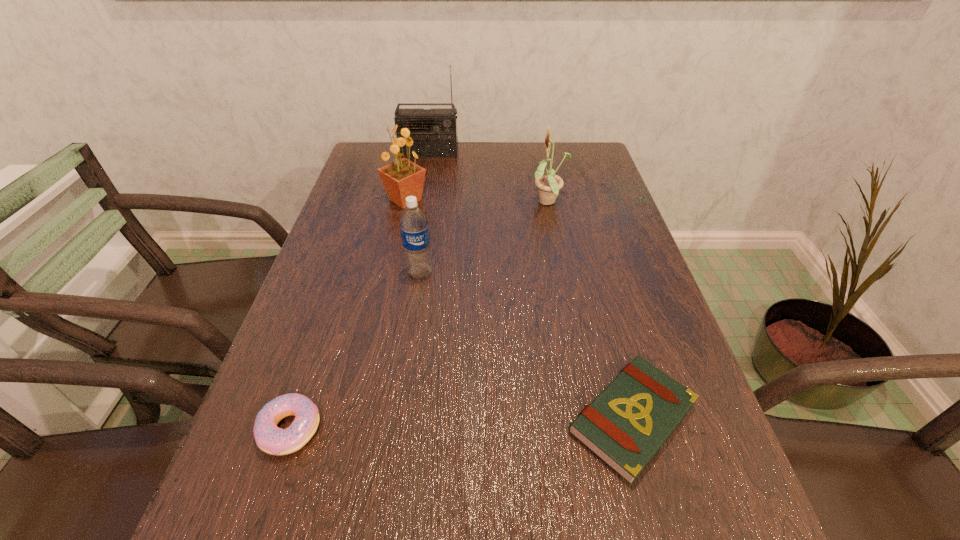
Image resolution: width=960 pixels, height=540 pixels. I want to click on the farthest object, so click(435, 133).

Locate an element on the screen. This screenshot has width=960, height=540. the tallest object is located at coordinates (435, 133).

The image size is (960, 540). Find the location of `the left sunflower`. the left sunflower is located at coordinates (402, 178).

In order to click on the right sunflower in this screenshot , I will do `click(549, 184)`.

I want to click on water bottle, so click(414, 228).

You are a GUI agent. You are given a task and a screenshot of the screen. Output one action in this format:
    pyautogui.click(x=<x>, y=<y>)
    Task: Click on the doughnut
    The height and width of the screenshot is (540, 960).
    Given the screenshot: What is the action you would take?
    pyautogui.click(x=271, y=439)

This screenshot has width=960, height=540. I want to click on the shortest object, so (627, 423).

Identify the location of vacant space located 0.390m on the front panel of the farthest object. The width and height of the screenshot is (960, 540). (416, 232).

Locate an element on the screen. The width and height of the screenshot is (960, 540). vacant space located 0.230m at the front of the left sunflower with flowers visible is located at coordinates (511, 200).

The height and width of the screenshot is (540, 960). I want to click on vacant space situated 0.090m on the front-facing side of the right sunflower, so click(x=497, y=203).